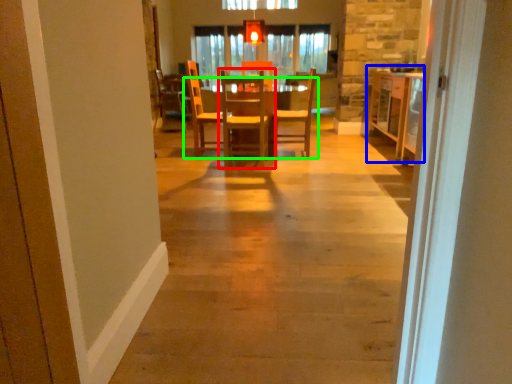
Question: Which is farther away from chair (highlighted by a red box)? table (highlighted by a blue box) or table (highlighted by a green box)?

Choices:
 (A) table
 (B) table

Answer: (A)